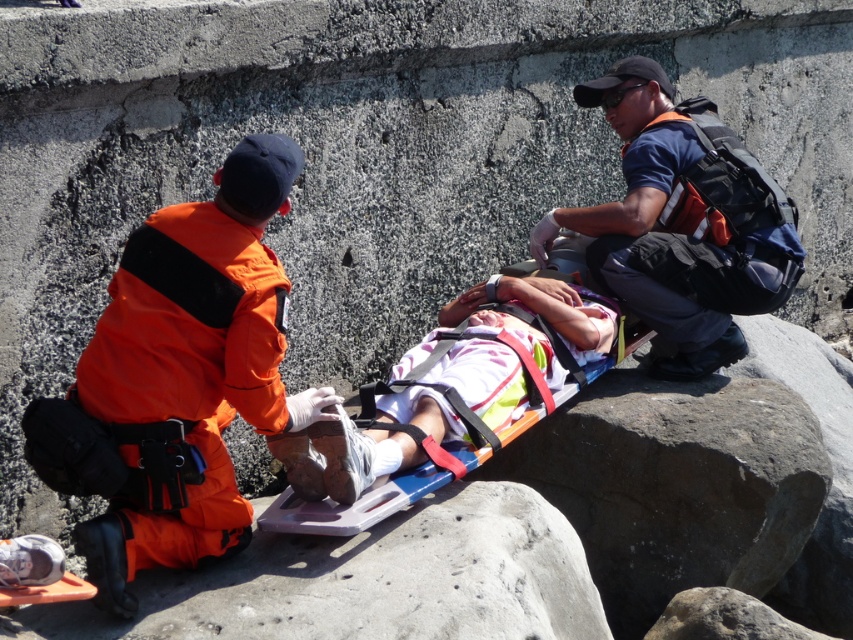
Which is below, blue fabric backpack at upper right or plastic stretcher at center?

Positioned lower is plastic stretcher at center.

Who is more distant from viewer, (662,269) or (380,493)?

Positioned behind is point (662,269).

Where is `blue fabric backpack at upper right`? blue fabric backpack at upper right is located at coordinates (672, 232).

Who is taller, orange fabric uniform at left or blue fabric backpack at upper right?

blue fabric backpack at upper right is taller.

Between orange fabric uniform at left and blue fabric backpack at upper right, which one is positioned higher?

blue fabric backpack at upper right

Image resolution: width=853 pixels, height=640 pixels. Describe the element at coordinates (178, 380) in the screenshot. I see `orange fabric uniform at left` at that location.

This screenshot has height=640, width=853. In order to click on orange fabric uniform at left in this screenshot , I will do (x=178, y=380).

Is point (202, 202) positioned after point (344, 515)?

Yes.

Does orange fabric uniform at left have a lesser height compared to plastic stretcher at center?

No.

The width and height of the screenshot is (853, 640). What do you see at coordinates (178, 380) in the screenshot?
I see `orange fabric uniform at left` at bounding box center [178, 380].

Locate an element on the screen. The height and width of the screenshot is (640, 853). orange fabric uniform at left is located at coordinates (178, 380).